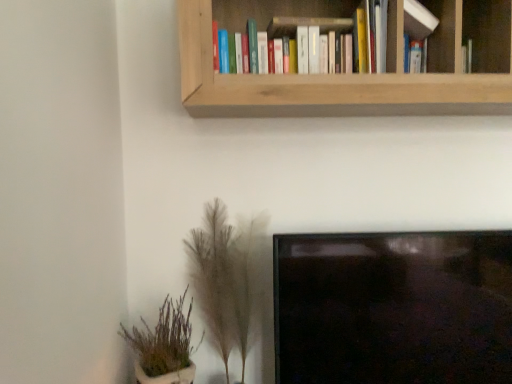
Locate an element on the screen. hardcover books at upper center, placed as the 2th book when sorted from right to left is located at coordinates (276, 11).

Describe the element at coordinates (419, 25) in the screenshot. The width and height of the screenshot is (512, 384). I see `white matte book at upper right, the 2th book positioned from the left` at that location.

What do you see at coordinates (227, 279) in the screenshot?
I see `fuzzy beige plant at lower center, positioned as the 1th houseplant in right-to-left order` at bounding box center [227, 279].

The width and height of the screenshot is (512, 384). Find the location of `fuzzy beige plant at lower center, positioned as the 1th houseplant in right-to-left order`. fuzzy beige plant at lower center, positioned as the 1th houseplant in right-to-left order is located at coordinates (227, 279).

The width and height of the screenshot is (512, 384). Identify the location of hardcover books at upper center, placed as the 2th book when sorted from right to left. (276, 11).

Which is farther from the camera, (335, 96) or (315, 2)?

The point (315, 2) is farther.

Choose the correct answer: Is wooden bookshelf at upper center inside hardcover books at upper center, placed as the 2th book when sorted from right to left, or outside it?

wooden bookshelf at upper center is located beyond the bounds of hardcover books at upper center, placed as the 2th book when sorted from right to left.

From a real-world perspective, is wooden bookshelf at upper center physically above hardcover books at upper center, placed as the 2th book when sorted from right to left?

No, from a real-world perspective, wooden bookshelf at upper center is not on top of hardcover books at upper center, placed as the 2th book when sorted from right to left.

Is wooden bookshelf at upper center in front of hardcover books at upper center, the first book in the left-to-right sequence?

Yes, the depth of wooden bookshelf at upper center is less than that of hardcover books at upper center, the first book in the left-to-right sequence.

From a real-world perspective, is fuzzy beige plant at lower center, positioned as the 1th houseplant in right-to-left order, physically above green leafy plant at lower left, which is the 1th houseplant from left to right?

Yes, from a real-world perspective, fuzzy beige plant at lower center, positioned as the 1th houseplant in right-to-left order, is above green leafy plant at lower left, which is the 1th houseplant from left to right.

Is fuzzy beige plant at lower center, the second houseplant positioned from the left, not inside green leafy plant at lower left, the 2th houseplant from the right?

Yes, fuzzy beige plant at lower center, the second houseplant positioned from the left, is outside of green leafy plant at lower left, the 2th houseplant from the right.

Is fuzzy beige plant at lower center, positioned as the 1th houseplant in right-to-left order, not near green leafy plant at lower left, the 2th houseplant from the right?

No, fuzzy beige plant at lower center, positioned as the 1th houseplant in right-to-left order, is in close proximity to green leafy plant at lower left, the 2th houseplant from the right.

Consider the image. Can you confirm if hardcover books at upper center, the first book in the left-to-right sequence, is taller than wooden bookshelf at upper center?

Incorrect, the height of hardcover books at upper center, the first book in the left-to-right sequence, is not larger of that of wooden bookshelf at upper center.

Is hardcover books at upper center, the first book in the left-to-right sequence, wider or thinner than wooden bookshelf at upper center?

Clearly, hardcover books at upper center, the first book in the left-to-right sequence, has less width compared to wooden bookshelf at upper center.

Which point is more forward, (243,19) or (234,77)?

The point (234,77) is more forward.

Would you say hardcover books at upper center, the first book in the left-to-right sequence, is inside or outside wooden bookshelf at upper center?

The correct answer is: inside.

Who is taller, white matte book at upper right, marked as the first book in a right-to-left arrangement, or green leafy plant at lower left, which is the 1th houseplant from left to right?

green leafy plant at lower left, which is the 1th houseplant from left to right, is taller.

Between point (421, 62) and point (141, 330), which one is positioned behind?

The point (141, 330) is farther.

From the image's perspective, is white matte book at upper right, the 2th book positioned from the left, located above green leafy plant at lower left, which is the 1th houseplant from left to right?

Yes, from the image's perspective, white matte book at upper right, the 2th book positioned from the left, is on top of green leafy plant at lower left, which is the 1th houseplant from left to right.

How many degrees apart are the facing directions of fuzzy beige plant at lower center, the second houseplant positioned from the left, and white matte book at upper right, the 2th book positioned from the left?

1.63 degrees separate the facing orientations of fuzzy beige plant at lower center, the second houseplant positioned from the left, and white matte book at upper right, the 2th book positioned from the left.

Is fuzzy beige plant at lower center, positioned as the 1th houseplant in right-to-left order, oriented towards white matte book at upper right, marked as the first book in a right-to-left arrangement?

No.

Considering the sizes of objects fuzzy beige plant at lower center, the second houseplant positioned from the left, and white matte book at upper right, the 2th book positioned from the left, in the image provided, who is bigger, fuzzy beige plant at lower center, the second houseplant positioned from the left, or white matte book at upper right, the 2th book positioned from the left,?

Bigger between the two is fuzzy beige plant at lower center, the second houseplant positioned from the left.

From a real-world perspective, which object rests below the other?

fuzzy beige plant at lower center, positioned as the 1th houseplant in right-to-left order, is physically lower.

Is hardcover books at upper center, the first book in the left-to-right sequence, positioned behind green leafy plant at lower left, the 2th houseplant from the right?

Yes, it is.

Is hardcover books at upper center, placed as the 2th book when sorted from right to left, located outside green leafy plant at lower left, which is the 1th houseplant from left to right?

Yes, hardcover books at upper center, placed as the 2th book when sorted from right to left, is outside of green leafy plant at lower left, which is the 1th houseplant from left to right.

Is hardcover books at upper center, the first book in the left-to-right sequence, at the left side of green leafy plant at lower left, the 2th houseplant from the right?

No, hardcover books at upper center, the first book in the left-to-right sequence, is not to the left of green leafy plant at lower left, the 2th houseplant from the right.

Is hardcover books at upper center, placed as the 2th book when sorted from right to left, not near green leafy plant at lower left, the 2th houseplant from the right?

hardcover books at upper center, placed as the 2th book when sorted from right to left, is near green leafy plant at lower left, the 2th houseplant from the right, not far away.

Consider the image. Which object is further away from the camera, hardcover books at upper center, placed as the 2th book when sorted from right to left, or fuzzy beige plant at lower center, positioned as the 1th houseplant in right-to-left order?

fuzzy beige plant at lower center, positioned as the 1th houseplant in right-to-left order, is behind.

Which point is more distant from viewer, (392,69) or (199,239)?

The point (199,239) is behind.

From the image's perspective, between hardcover books at upper center, the first book in the left-to-right sequence, and fuzzy beige plant at lower center, positioned as the 1th houseplant in right-to-left order, which one is located above?

hardcover books at upper center, the first book in the left-to-right sequence.

Does hardcover books at upper center, placed as the 2th book when sorted from right to left, have a smaller size compared to fuzzy beige plant at lower center, the second houseplant positioned from the left?

Indeed, hardcover books at upper center, placed as the 2th book when sorted from right to left, has a smaller size compared to fuzzy beige plant at lower center, the second houseplant positioned from the left.

From the image's perspective, count 1st books upward from the wooden bookshelf at upper center and point to it. Please provide its 2D coordinates.

[(276, 11)]

Find the location of a particular element. The image size is (512, 384). houseplant lying on the right of green leafy plant at lower left, which is the 1th houseplant from left to right is located at coordinates (227, 279).

Estimate the real-world distances between objects in this image. Which object is further from hardcover books at upper center, placed as the 2th book when sorted from right to left, fuzzy beige plant at lower center, the second houseplant positioned from the left, or green leafy plant at lower left, which is the 1th houseplant from left to right?

Among the two, green leafy plant at lower left, which is the 1th houseplant from left to right, is located further to hardcover books at upper center, placed as the 2th book when sorted from right to left.

Looking at the image, which one is located closer to green leafy plant at lower left, the 2th houseplant from the right, wooden bookshelf at upper center or hardcover books at upper center, the first book in the left-to-right sequence?

Among the two, wooden bookshelf at upper center is located nearer to green leafy plant at lower left, the 2th houseplant from the right.

Which object lies further to the anchor point fuzzy beige plant at lower center, positioned as the 1th houseplant in right-to-left order, white matte book at upper right, marked as the first book in a right-to-left arrangement, or green leafy plant at lower left, the 2th houseplant from the right?

Among the two, white matte book at upper right, marked as the first book in a right-to-left arrangement, is located further to fuzzy beige plant at lower center, positioned as the 1th houseplant in right-to-left order.

Based on their spatial positions, is white matte book at upper right, the 2th book positioned from the left, or wooden bookshelf at upper center further from hardcover books at upper center, placed as the 2th book when sorted from right to left?

white matte book at upper right, the 2th book positioned from the left.

Based on their spatial positions, is white matte book at upper right, the 2th book positioned from the left, or wooden bookshelf at upper center further from fuzzy beige plant at lower center, positioned as the 1th houseplant in right-to-left order?

The object further to fuzzy beige plant at lower center, positioned as the 1th houseplant in right-to-left order, is white matte book at upper right, the 2th book positioned from the left.

Looking at the image, which one is located closer to wooden bookshelf at upper center, green leafy plant at lower left, which is the 1th houseplant from left to right, or white matte book at upper right, marked as the first book in a right-to-left arrangement?

Among the two, white matte book at upper right, marked as the first book in a right-to-left arrangement, is located nearer to wooden bookshelf at upper center.

Considering their positions, is white matte book at upper right, marked as the first book in a right-to-left arrangement, positioned further to hardcover books at upper center, placed as the 2th book when sorted from right to left, than fuzzy beige plant at lower center, positioned as the 1th houseplant in right-to-left order?

fuzzy beige plant at lower center, positioned as the 1th houseplant in right-to-left order.

Considering their positions, is fuzzy beige plant at lower center, the second houseplant positioned from the left, positioned further to green leafy plant at lower left, which is the 1th houseplant from left to right, than white matte book at upper right, the 2th book positioned from the left?

Among the two, white matte book at upper right, the 2th book positioned from the left, is located further to green leafy plant at lower left, which is the 1th houseplant from left to right.

Locate an element on the screen. book between white matte book at upper right, the 2th book positioned from the left, and green leafy plant at lower left, which is the 1th houseplant from left to right, in the up-down direction is located at coordinates (276, 11).

Where is `bookcase between hardcover books at upper center, placed as the 2th book when sorted from right to left, and fuzzy beige plant at lower center, the second houseplant positioned from the left, vertically`? Image resolution: width=512 pixels, height=384 pixels. bookcase between hardcover books at upper center, placed as the 2th book when sorted from right to left, and fuzzy beige plant at lower center, the second houseplant positioned from the left, vertically is located at coordinates (353, 74).

This screenshot has width=512, height=384. What are the coordinates of `bookcase that lies between white matte book at upper right, marked as the first book in a right-to-left arrangement, and fuzzy beige plant at lower center, the second houseplant positioned from the left, from top to bottom` in the screenshot? It's located at (353, 74).

Image resolution: width=512 pixels, height=384 pixels. What are the coordinates of `houseplant between hardcover books at upper center, placed as the 2th book when sorted from right to left, and green leafy plant at lower left, the 2th houseplant from the right, in the up-down direction` in the screenshot? It's located at (227, 279).